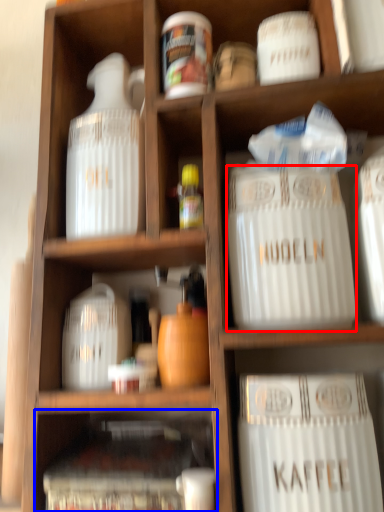
Question: Which object appears closest to the camera in this image, type (highlighted by a red box) or cabinet (highlighted by a blue box)?

Choices:
 (A) type
 (B) cabinet

Answer: (B)